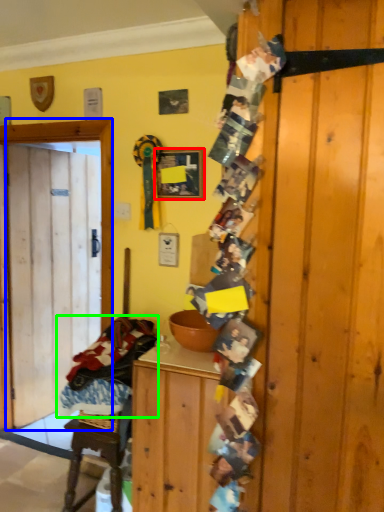
Question: Estimate the real-world distances between objects in this image. Which object is farther from picture frame (highlighted by a red box), door (highlighted by a blue box) or laundry (highlighted by a green box)?

Choices:
 (A) door
 (B) laundry

Answer: (B)